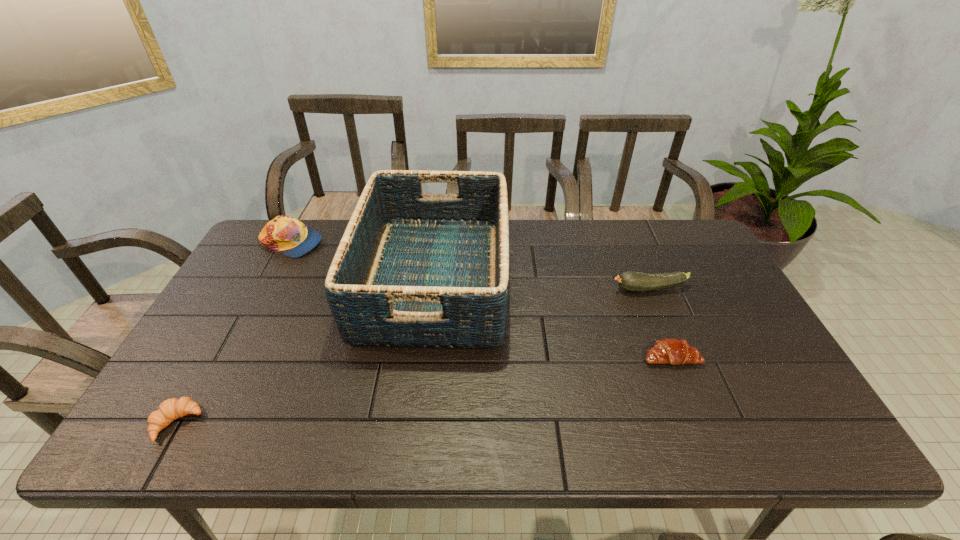
Locate an element on the screen. The width and height of the screenshot is (960, 540). object that is at the far left corner is located at coordinates (287, 235).

Locate an element on the screen. object at the near left corner is located at coordinates (169, 410).

This screenshot has height=540, width=960. In the image, there is a desktop. In order to click on blank space at the far edge in this screenshot , I will do `click(603, 260)`.

You are a GUI agent. You are given a task and a screenshot of the screen. Output one action in this format:
    pyautogui.click(x=<x>, y=<y>)
    Task: Click on the vacant space at the near edge of the desktop
    This screenshot has height=540, width=960.
    Given the screenshot: What is the action you would take?
    pyautogui.click(x=236, y=419)

The image size is (960, 540). I want to click on vacant space at the left edge of the desktop, so click(219, 393).

I want to click on vacant space at the right edge of the desktop, so click(708, 266).

Locate an element on the screen. The height and width of the screenshot is (540, 960). vacant space at the near left corner of the desktop is located at coordinates (167, 444).

The width and height of the screenshot is (960, 540). Find the location of `free space between the nearest object and the third shortest object`. free space between the nearest object and the third shortest object is located at coordinates (413, 356).

Locate an element on the screen. The width and height of the screenshot is (960, 540). empty space between the nearer crescent roll and the farther crescent roll is located at coordinates (423, 390).

Locate an element on the screen. This screenshot has height=540, width=960. vacant area between the cap and the left crescent roll is located at coordinates (234, 333).